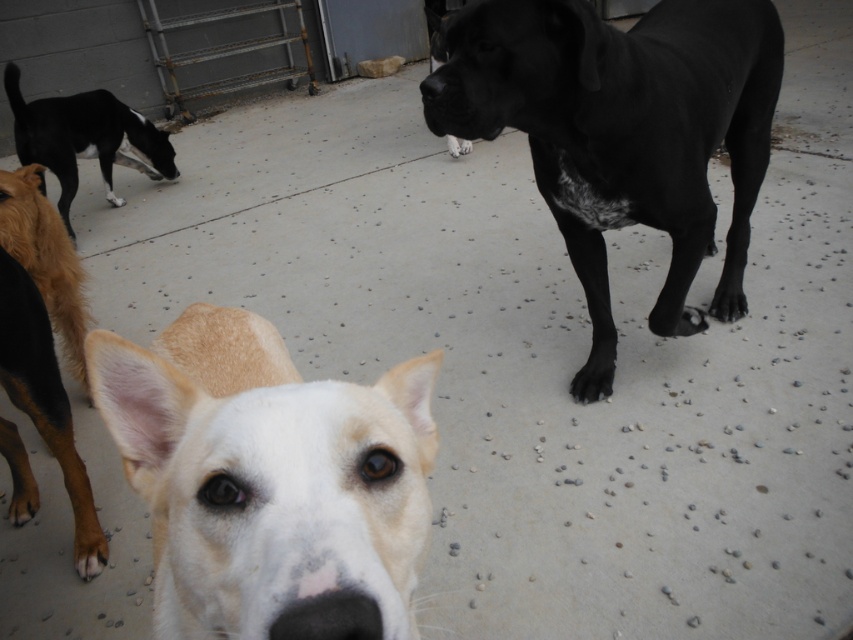
You are a dog trainer assessing the dogs in the image. Which dog, the black smooth dog at upper right or the brown fur at lower left, would you expect to have a larger size based on their positions in the image?

The black smooth dog at upper right is bigger than brown fur at lower left.

Based on the scene description, where is the white fur dog at center located in terms of its 2D coordinates?

The white fur dog at center is located at the 2D coordinates of point (270, 480).

You are standing at the origin point of the image. You want to walk towards the white fur dog at center located at point (270,480). Will you pass through any other dogs along the way?

No, there are no other dogs along the path to the white fur dog at center at point (270,480).